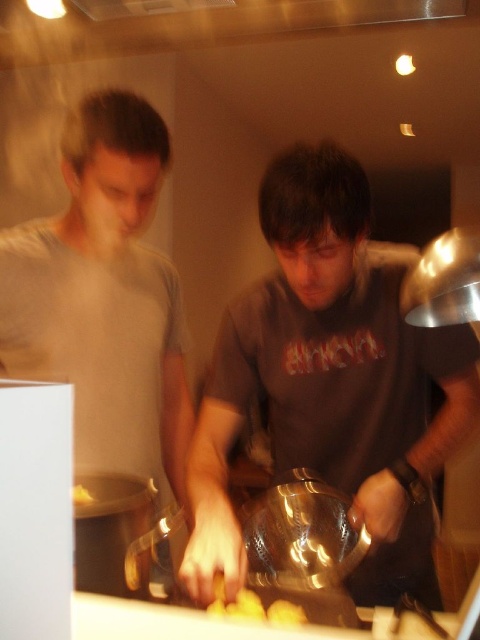
Question: Can you confirm if yellow matte potato at center is smaller than yellow matte potato at lower left?

Choices:
 (A) yes
 (B) no

Answer: (A)

Question: Estimate the real-world distances between objects in this image. Which object is closer to the matte gray shirt at left?

Choices:
 (A) yellow matte potato at lower left
 (B) matte gray shirt at center

Answer: (B)

Question: Based on their relative distances, which object is nearer to the yellow matte potato at lower left?

Choices:
 (A) matte gray shirt at left
 (B) matte gray shirt at center
 (C) yellow matte potato at center

Answer: (C)

Question: In this image, where is matte gray shirt at center located relative to yellow matte potato at lower left?

Choices:
 (A) below
 (B) above

Answer: (B)

Question: Which of the following is the closest to the observer?

Choices:
 (A) yellow matte potato at lower left
 (B) metallic silver exhaust hood at upper right
 (C) matte gray shirt at center

Answer: (B)

Question: Is matte gray shirt at center thinner than matte gray shirt at left?

Choices:
 (A) no
 (B) yes

Answer: (A)